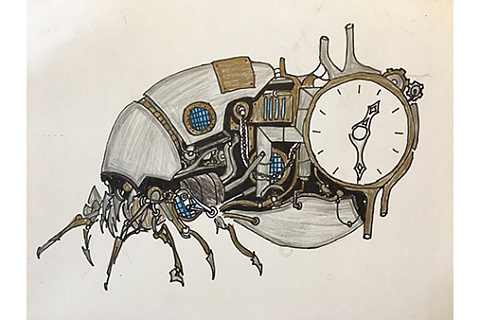
Where is `clock`? clock is located at coordinates (367, 128).